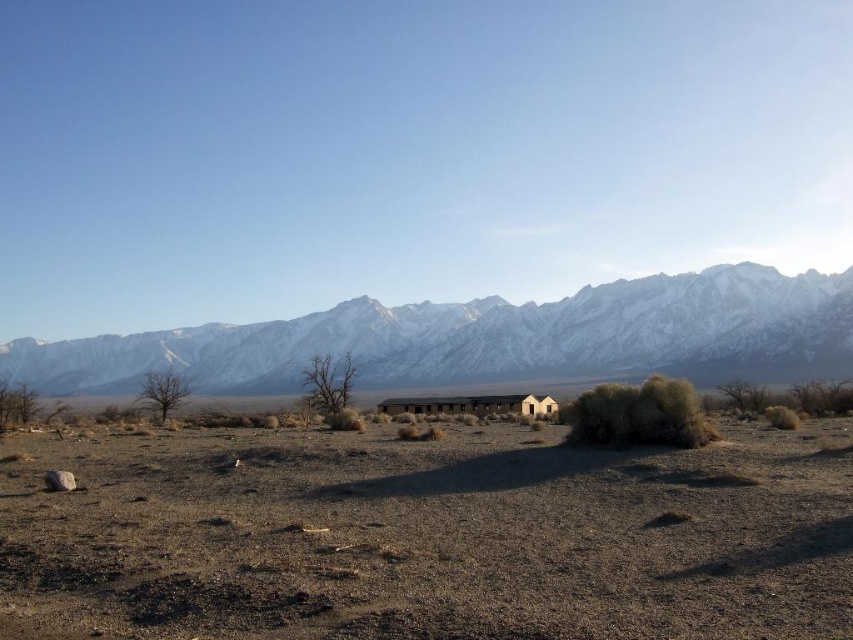
Question: Does brown/dry soil at center appear under snowy granite mountain range at upper center?

Choices:
 (A) no
 (B) yes

Answer: (B)

Question: Can you confirm if brown/dry soil at center is positioned to the right of snowy granite mountain range at upper center?

Choices:
 (A) yes
 (B) no

Answer: (A)

Question: Does brown/dry soil at center appear on the left side of snowy granite mountain range at upper center?

Choices:
 (A) no
 (B) yes

Answer: (A)

Question: Among these points, which one is nearest to the camera?

Choices:
 (A) (91, 352)
 (B) (698, 588)

Answer: (B)

Question: Which point is closer to the camera?

Choices:
 (A) (270, 628)
 (B) (585, 349)

Answer: (A)

Question: Which point is closer to the camera taking this photo?

Choices:
 (A) (251, 602)
 (B) (351, 330)

Answer: (A)